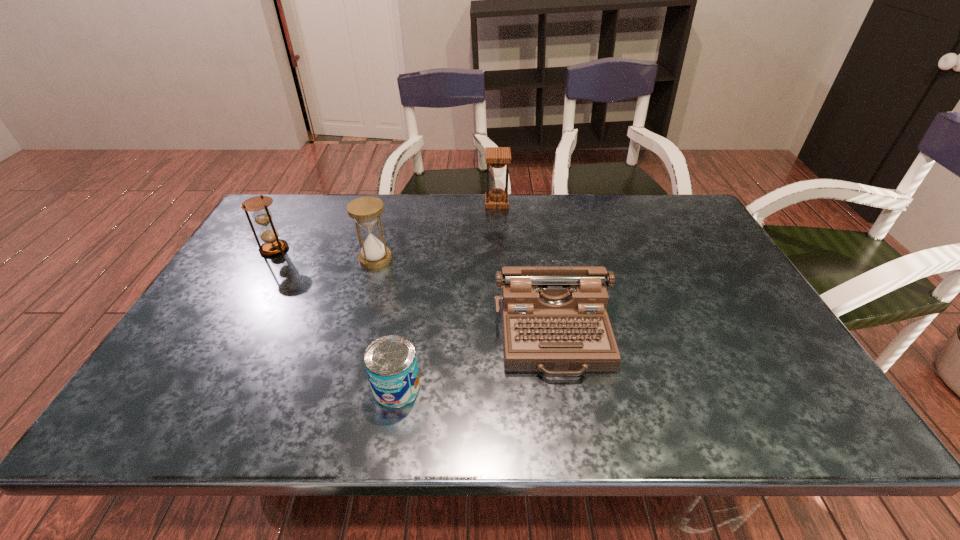
Find the location of `hourglass that is the third closest to the typewriter`. hourglass that is the third closest to the typewriter is located at coordinates (261, 215).

Where is `the second closest hourglass to the fourth object from right to left`? This screenshot has height=540, width=960. the second closest hourglass to the fourth object from right to left is located at coordinates (497, 158).

You are a GUI agent. You are given a task and a screenshot of the screen. Output one action in this format:
    pyautogui.click(x=<x>, y=<y>)
    Task: Click on the vacant area that satisfies the following two spatial constraints: 1. on the back side of the third object from left to right; 2. on the right side of the farthest object
    This screenshot has width=960, height=540.
    Given the screenshot: What is the action you would take?
    pyautogui.click(x=427, y=202)

The height and width of the screenshot is (540, 960). I want to click on vacant space that satisfies the following two spatial constraints: 1. on the front side of the leftmost hourglass; 2. on the left side of the second hourglass from right to left, so click(269, 259).

Where is `free space that satisfies the following two spatial constraints: 1. on the back side of the leftmost hourglass; 2. on the right side of the farthest hourglass`? This screenshot has height=540, width=960. free space that satisfies the following two spatial constraints: 1. on the back side of the leftmost hourglass; 2. on the right side of the farthest hourglass is located at coordinates (300, 202).

You are a GUI agent. You are given a task and a screenshot of the screen. Output one action in this format:
    pyautogui.click(x=<x>, y=<y>)
    Task: Click on the vacant position in the image that satisfies the following two spatial constraints: 1. on the front side of the leftmost hourglass; 2. on the left side of the third object from right to left
    Image resolution: width=960 pixels, height=540 pixels.
    Given the screenshot: What is the action you would take?
    pyautogui.click(x=195, y=387)